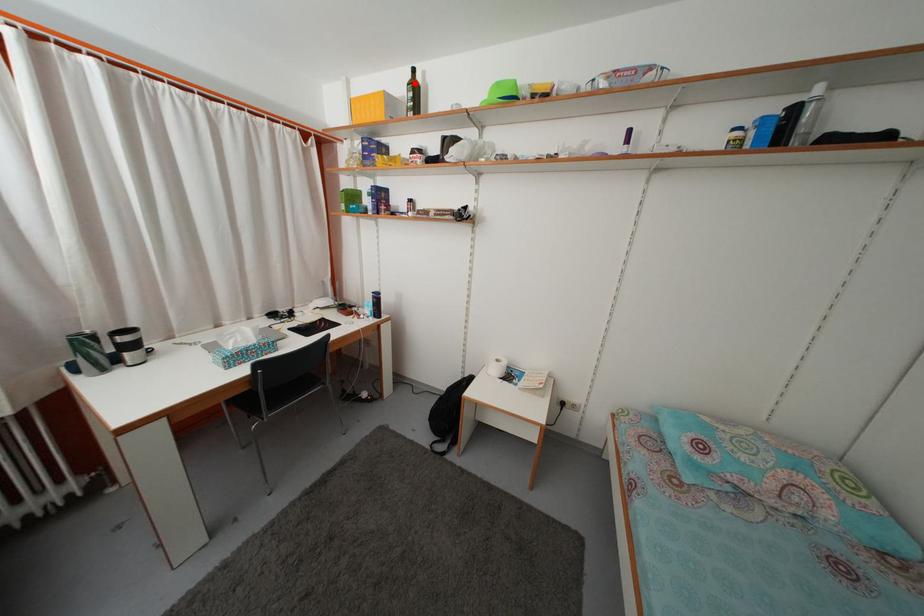
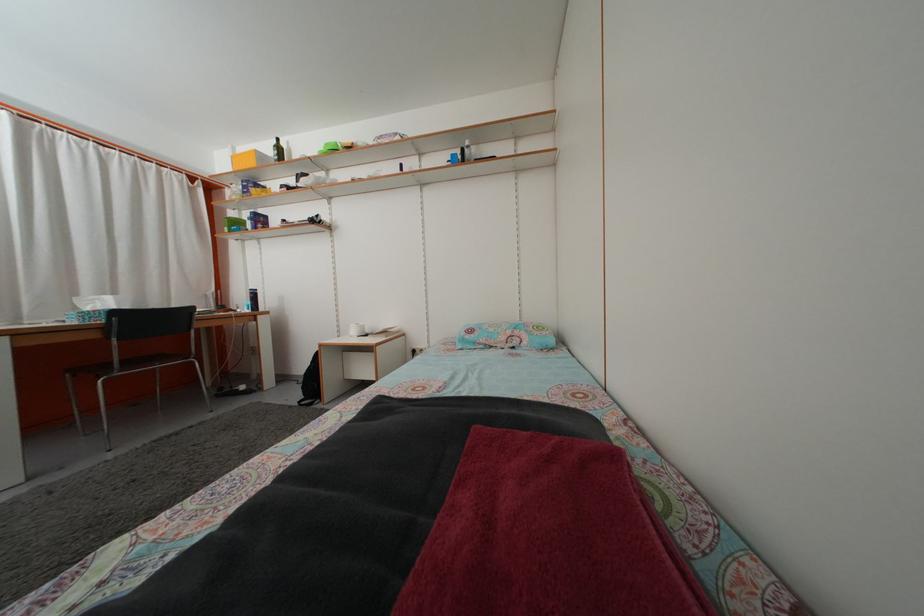
Find the pixel in the second image that matches the highlighted location in the first image.

(281, 148)